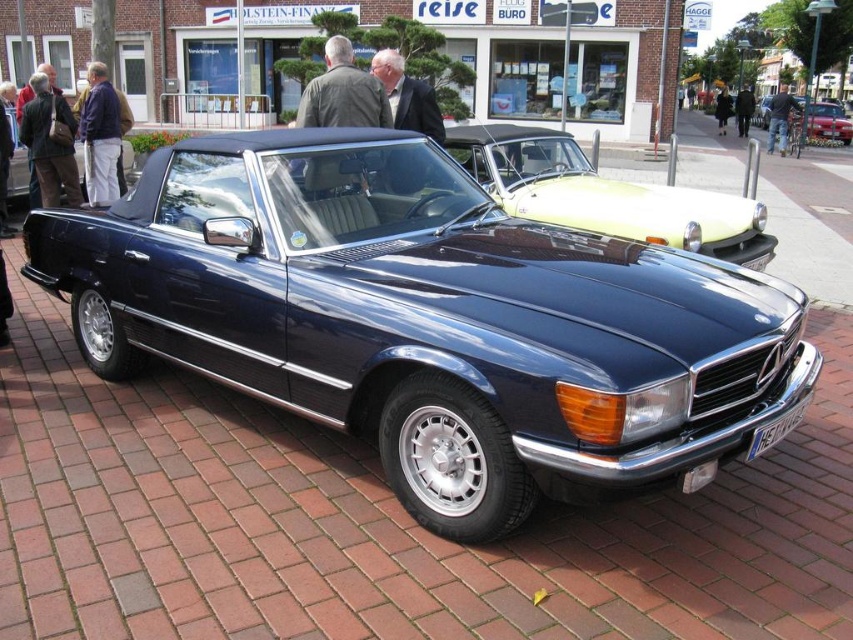
Is the position of shiny dark blue convertible at center more distant than that of black leather jacket at center?

No, shiny dark blue convertible at center is in front of black leather jacket at center.

Does shiny dark blue convertible at center appear over black leather jacket at center?

Incorrect, shiny dark blue convertible at center is not positioned above black leather jacket at center.

Where is `shiny dark blue convertible at center`? shiny dark blue convertible at center is located at coordinates (426, 320).

Can you confirm if blue jeans at left is thinner than metallic silver convertible at center?

Correct, blue jeans at left's width is less than metallic silver convertible at center's.

The width and height of the screenshot is (853, 640). I want to click on blue jeans at left, so 100,134.

Does blue denim jeans at center have a greater width compared to black leather jacket at center?

Indeed, blue denim jeans at center has a greater width compared to black leather jacket at center.

Can you confirm if blue denim jeans at center is smaller than black leather jacket at center?

Incorrect, blue denim jeans at center is not smaller in size than black leather jacket at center.

Describe the element at coordinates (780, 118) in the screenshot. I see `blue denim jeans at center` at that location.

The image size is (853, 640). I want to click on blue denim jeans at center, so click(x=780, y=118).